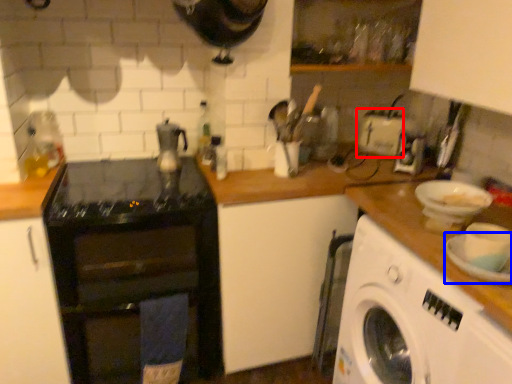
Question: Among these objects, which one is nearest to the camera, appliance (highlighted by a red box) or plate (highlighted by a blue box)?

Choices:
 (A) appliance
 (B) plate

Answer: (B)